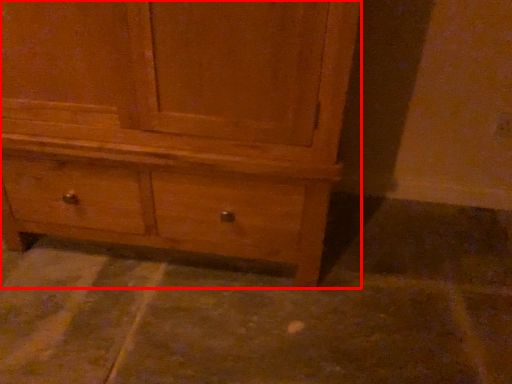
Question: From the image's perspective, what is the correct spatial positioning of chest of drawers (annotated by the red box) in reference to concrete?

Choices:
 (A) below
 (B) above

Answer: (B)